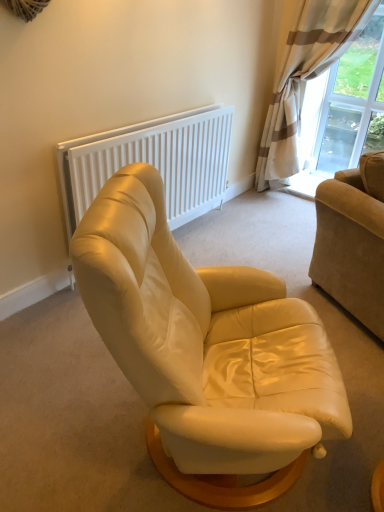
Locate an element on the screen. vacant space situated on the left part of beige striped curtain at upper right is located at coordinates (250, 211).